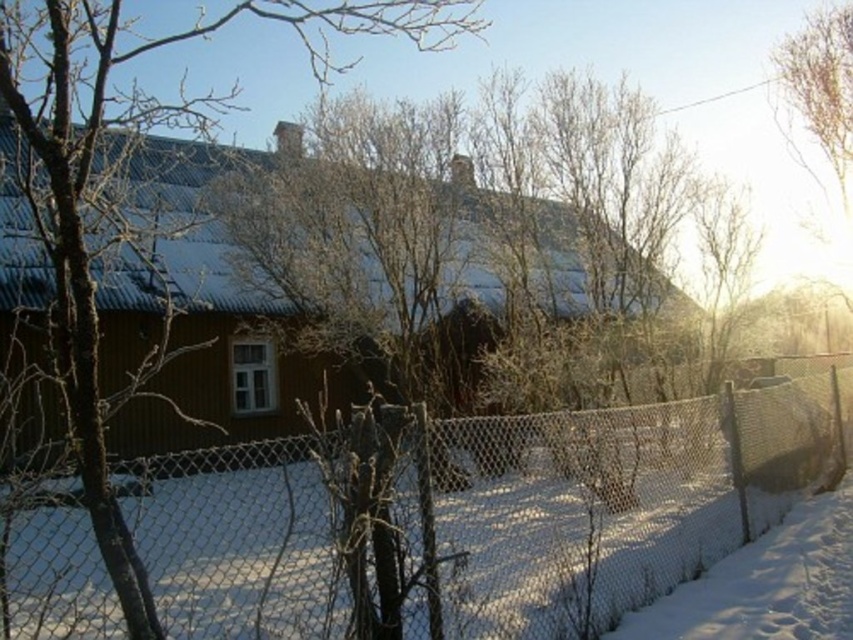
Question: Among these objects, which one is nearest to the camera?

Choices:
 (A) wire mesh fence at center
 (B) white powdery snow at lower right

Answer: (A)

Question: Can you confirm if wire mesh fence at center is thinner than brown wood tree at center?

Choices:
 (A) yes
 (B) no

Answer: (B)

Question: Can you confirm if wire mesh fence at center is positioned below brown wood tree at center?

Choices:
 (A) no
 (B) yes

Answer: (B)

Question: Which point is farther to the camera?

Choices:
 (A) white powdery snow at lower right
 (B) wire mesh fence at center

Answer: (A)

Question: Estimate the real-world distances between objects in this image. Which object is closer to the brown wood tree at center?

Choices:
 (A) white powdery snow at lower right
 (B) wire mesh fence at center

Answer: (B)

Question: In this image, where is wire mesh fence at center located relative to white powdery snow at lower right?

Choices:
 (A) below
 (B) above

Answer: (B)